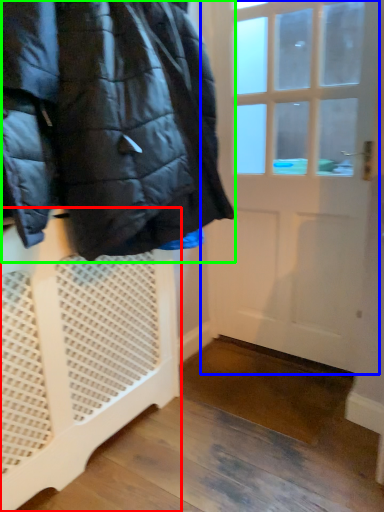
Question: Which object is positioned closest to furniture (highlighted by a red box)? Select from door (highlighted by a blue box) and jacket (highlighted by a green box).

Choices:
 (A) door
 (B) jacket

Answer: (B)